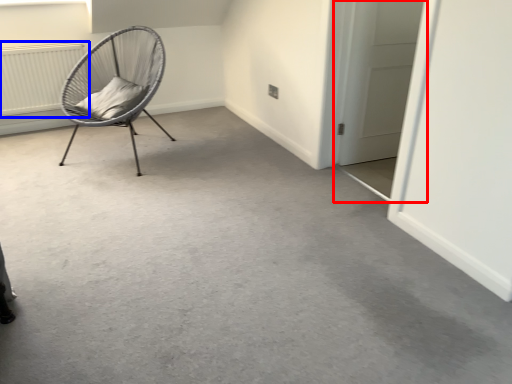
Question: Which point is further to the camera, door (highlighted by a red box) or radiator (highlighted by a blue box)?

Choices:
 (A) door
 (B) radiator

Answer: (B)